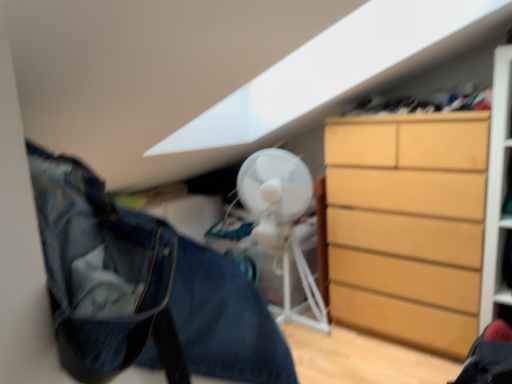
Question: Can you confirm if denim jacket at lower left is smaller than light brown wooden chest of drawers at right?

Choices:
 (A) no
 (B) yes

Answer: (B)

Question: Is light brown wooden chest of drawers at right at the back of denim jacket at lower left?

Choices:
 (A) no
 (B) yes

Answer: (A)

Question: Is denim jacket at lower left closer to camera compared to light brown wooden chest of drawers at right?

Choices:
 (A) yes
 (B) no

Answer: (A)

Question: From the image's perspective, is denim jacket at lower left located beneath light brown wooden chest of drawers at right?

Choices:
 (A) yes
 (B) no

Answer: (A)

Question: From the image's perspective, would you say denim jacket at lower left is positioned over light brown wooden chest of drawers at right?

Choices:
 (A) no
 (B) yes

Answer: (A)

Question: Is white plastic mechanical fan at center in front of or behind light brown wooden chest of drawers at right in the image?

Choices:
 (A) behind
 (B) front

Answer: (A)

Question: From a real-world perspective, relative to light brown wooden chest of drawers at right, is white plastic mechanical fan at center vertically above or below?

Choices:
 (A) above
 (B) below

Answer: (B)

Question: Do you think white plastic mechanical fan at center is within light brown wooden chest of drawers at right, or outside of it?

Choices:
 (A) outside
 (B) inside

Answer: (A)

Question: From the image's perspective, is white plastic mechanical fan at center located above or below light brown wooden chest of drawers at right?

Choices:
 (A) below
 (B) above

Answer: (A)

Question: In terms of height, does white plastic mechanical fan at center look taller or shorter compared to denim jacket at lower left?

Choices:
 (A) tall
 (B) short

Answer: (A)

Question: From a real-world perspective, relative to denim jacket at lower left, is white plastic mechanical fan at center vertically above or below?

Choices:
 (A) below
 (B) above

Answer: (A)

Question: Based on their positions, is white plastic mechanical fan at center located to the left or right of denim jacket at lower left?

Choices:
 (A) right
 (B) left

Answer: (A)

Question: Would you say white plastic mechanical fan at center is inside or outside denim jacket at lower left?

Choices:
 (A) inside
 (B) outside

Answer: (B)

Question: Relative to light brown wooden chest of drawers at right, is denim jacket at lower left in front or behind?

Choices:
 (A) front
 (B) behind

Answer: (A)

Question: In terms of width, does denim jacket at lower left look wider or thinner when compared to light brown wooden chest of drawers at right?

Choices:
 (A) wide
 (B) thin

Answer: (A)